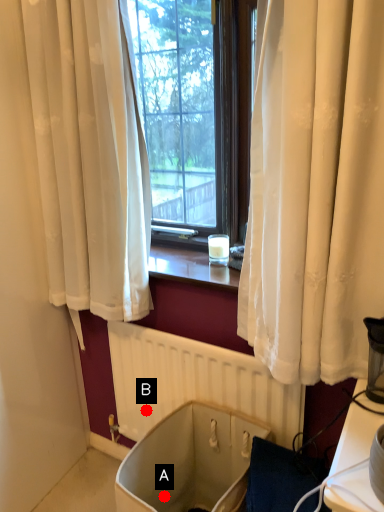
Question: Two points are circled on the image, labeled by A and B beside each circle. Which point is further to the camera?

Choices:
 (A) A is further
 (B) B is further

Answer: (B)